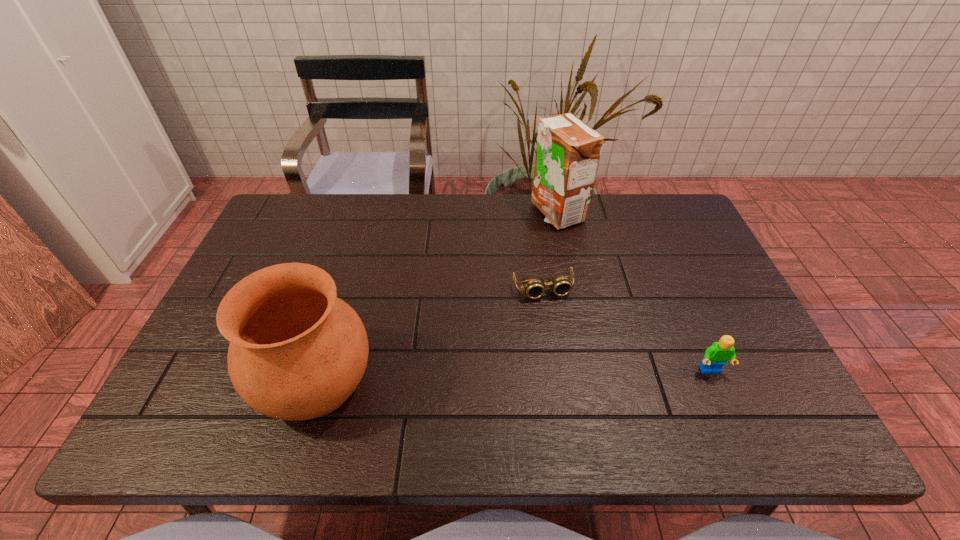
Locate an element on the screen. vacant region at the left edge is located at coordinates (276, 248).

You are a GUI agent. You are given a task and a screenshot of the screen. Output one action in this format:
    pyautogui.click(x=<x>, y=<y>)
    Task: Click on the free space at the far left corner of the desktop
    
    Given the screenshot: What is the action you would take?
    pyautogui.click(x=287, y=206)

This screenshot has width=960, height=540. Find the location of `vacant point at the far right corner`. vacant point at the far right corner is located at coordinates (656, 202).

What are the coordinates of `free space between the second farthest object and the rightmost object` in the screenshot? It's located at (627, 330).

The height and width of the screenshot is (540, 960). What are the coordinates of `vacant area that lies between the pottery and the shortest object` in the screenshot? It's located at (429, 336).

This screenshot has width=960, height=540. Find the location of `free point between the shortest object and the Lego`. free point between the shortest object and the Lego is located at coordinates (627, 330).

This screenshot has height=540, width=960. In order to click on free space that is in between the Lego and the second farthest object in this screenshot , I will do tap(627, 330).

Find the location of a particular element. vacant space that's between the rightmost object and the leftmost object is located at coordinates (513, 377).

You are a GUI agent. You are given a task and a screenshot of the screen. Output one action in this format:
    pyautogui.click(x=<x>, y=<y>)
    Task: Click on the unoccupied position between the third tallest object and the shortest object
    The width and height of the screenshot is (960, 540).
    Given the screenshot: What is the action you would take?
    pyautogui.click(x=627, y=330)

Image resolution: width=960 pixels, height=540 pixels. Find the location of `vacant region between the Lego and the carton`. vacant region between the Lego and the carton is located at coordinates (634, 292).